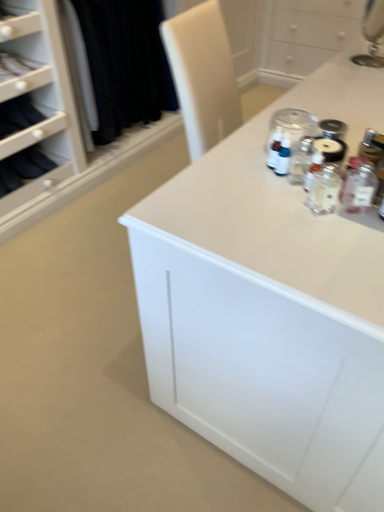
Describe the element at coordinates (292, 125) in the screenshot. Image resolution: width=384 pixels, height=512 pixels. I see `clear glass jar at upper center` at that location.

This screenshot has height=512, width=384. I want to click on clear glass bottle at right, the 1th bottle in the right-to-left sequence, so click(362, 189).

The width and height of the screenshot is (384, 512). Identify the location of clear glass jar at upper center. click(292, 125).

At what (x,y) coordinates should I click in order to perform the action: click on glass jar that appears below the white glossy countertop at upper right (from the image's perspective). Please return your answer as a coordinate pair (x, y). The width and height of the screenshot is (384, 512). Looking at the image, I should click on (292, 125).

Does white glossy countertop at upper right appear on the left side of clear glass jar at upper center?

Incorrect, white glossy countertop at upper right is not on the left side of clear glass jar at upper center.

Is white glossy countertop at upper right shorter than clear glass jar at upper center?

Indeed, white glossy countertop at upper right has a lesser height compared to clear glass jar at upper center.

Could you tell me if white glossy countertop at upper right is turned towards clear glass jar at upper center?

No, white glossy countertop at upper right does not turn towards clear glass jar at upper center.

From the picture: From a real-world perspective, is clear glass jar at upper center positioned over white glossy countertop at upper right based on gravity?

Correct, in the physical world, clear glass jar at upper center is higher than white glossy countertop at upper right.

Does clear glass jar at upper center have a lesser height compared to white glossy countertop at upper right?

No.

Can you see clear glass jar at upper center touching white glossy countertop at upper right?

There is a gap between clear glass jar at upper center and white glossy countertop at upper right.

This screenshot has width=384, height=512. Identify the location of countertop above the clear glass jar at upper center (from the image's perspective). (271, 307).

Who is taller, matte black fabric at upper left or white glossy countertop at upper right?

matte black fabric at upper left.

Can you confirm if matte black fabric at upper left is positioned to the left of white glossy countertop at upper right?

Correct, you'll find matte black fabric at upper left to the left of white glossy countertop at upper right.

Can you tell me how much matte black fabric at upper left and white glossy countertop at upper right differ in facing direction?

They differ by 90.2 degrees in their facing directions.

From a real-world perspective, is matte black fabric at upper left below white glossy countertop at upper right?

Actually, matte black fabric at upper left is physically above white glossy countertop at upper right in the real world.

Which is behind, point (331, 196) or point (246, 394)?

The point (246, 394) is behind.

Looking at this image, is clear glass bottle at center, which is the first bottle in left-to-right order, in front of white glossy countertop at upper right?

No, clear glass bottle at center, which is the first bottle in left-to-right order, is further to the viewer.

Is clear glass bottle at center, acting as the second bottle starting from the right, not within white glossy countertop at upper right?

clear glass bottle at center, acting as the second bottle starting from the right, is positioned outside white glossy countertop at upper right.

Are clear glass bottle at center, acting as the second bottle starting from the right, and white glossy countertop at upper right far apart?

No, there isn't a large distance between clear glass bottle at center, acting as the second bottle starting from the right, and white glossy countertop at upper right.

Is clear glass bottle at center, acting as the second bottle starting from the right, not inside clear glass jar at upper center?

Yes, clear glass bottle at center, acting as the second bottle starting from the right, is not within clear glass jar at upper center.

Considering the positions of objects clear glass bottle at center, acting as the second bottle starting from the right, and clear glass jar at upper center in the image provided, who is more to the right, clear glass bottle at center, acting as the second bottle starting from the right, or clear glass jar at upper center?

clear glass bottle at center, acting as the second bottle starting from the right.

From a real-world perspective, which is physically below, clear glass bottle at center, which is the first bottle in left-to-right order, or clear glass jar at upper center?

From a 3D spatial view, clear glass bottle at center, which is the first bottle in left-to-right order, is below.

Considering the positions of objects clear glass jar at upper center and clear glass bottle at center, which is the first bottle in left-to-right order, in the image provided, who is more to the right, clear glass jar at upper center or clear glass bottle at center, which is the first bottle in left-to-right order,?

From the viewer's perspective, clear glass bottle at center, which is the first bottle in left-to-right order, appears more on the right side.

Is clear glass jar at upper center touching clear glass bottle at center, acting as the second bottle starting from the right?

There is a gap between clear glass jar at upper center and clear glass bottle at center, acting as the second bottle starting from the right.

From the image's perspective, would you say clear glass jar at upper center is shown under clear glass bottle at center, acting as the second bottle starting from the right?

Incorrect, from the image's perspective, clear glass jar at upper center is higher than clear glass bottle at center, acting as the second bottle starting from the right.

Is point (322, 407) closer or farther from the camera than point (328, 189)?

Point (322, 407) is positioned farther from the camera compared to point (328, 189).

Is white glossy countertop at upper right bigger or smaller than clear glass bottle at center, acting as the second bottle starting from the right?

white glossy countertop at upper right is bigger than clear glass bottle at center, acting as the second bottle starting from the right.

Between white glossy countertop at upper right and clear glass bottle at center, which is the first bottle in left-to-right order, which one is positioned behind?

clear glass bottle at center, which is the first bottle in left-to-right order, is more distant.

You are a GUI agent. You are given a task and a screenshot of the screen. Output one action in this format:
    pyautogui.click(x=<x>, y=<y>)
    Task: Click on the glass jar on the left of white glossy countertop at upper right
    
    Given the screenshot: What is the action you would take?
    pyautogui.click(x=292, y=125)

Locate an element on the screen. countertop in front of the clear glass jar at upper center is located at coordinates (271, 307).

Considering their positions, is clear glass jar at upper center positioned further to clear glass bottle at right, the 1th bottle in the right-to-left sequence, than white glossy countertop at upper right?

Among the two, white glossy countertop at upper right is located further to clear glass bottle at right, the 1th bottle in the right-to-left sequence.

Considering their positions, is matte black fabric at upper left positioned further to clear glass bottle at right, the 1th bottle in the right-to-left sequence, than clear glass jar at upper center?

matte black fabric at upper left.

Considering their positions, is white glossy countertop at upper right positioned closer to clear glass jar at upper center than clear glass bottle at right, positioned as the second bottle in left-to-right order?

The object closer to clear glass jar at upper center is clear glass bottle at right, positioned as the second bottle in left-to-right order.

When comparing their distances from clear glass jar at upper center, does clear glass bottle at right, positioned as the second bottle in left-to-right order, or clear glass bottle at center, acting as the second bottle starting from the right, seem closer?

Among the two, clear glass bottle at center, acting as the second bottle starting from the right, is located nearer to clear glass jar at upper center.

Which object lies further to the anchor point white glossy countertop at upper right, clear glass bottle at right, positioned as the second bottle in left-to-right order, or matte black fabric at upper left?

The object further to white glossy countertop at upper right is matte black fabric at upper left.

When comparing their distances from clear glass jar at upper center, does clear glass bottle at center, acting as the second bottle starting from the right, or white glossy countertop at upper right seem further?

white glossy countertop at upper right is positioned further to the anchor clear glass jar at upper center.

In the scene shown: Estimate the real-world distances between objects in this image. Which object is closer to white glossy countertop at upper right, clear glass bottle at right, positioned as the second bottle in left-to-right order, or clear glass bottle at center, which is the first bottle in left-to-right order?

clear glass bottle at center, which is the first bottle in left-to-right order, is positioned closer to the anchor white glossy countertop at upper right.

From the image, which object appears to be nearer to clear glass jar at upper center, white glossy countertop at upper right or clear glass bottle at center, which is the first bottle in left-to-right order?

clear glass bottle at center, which is the first bottle in left-to-right order, is positioned closer to the anchor clear glass jar at upper center.

Locate an element on the screen. bottle between white glossy countertop at upper right and clear glass bottle at center, which is the first bottle in left-to-right order, in the vertical direction is located at coordinates (362, 189).

Locate an element on the screen. This screenshot has height=512, width=384. glass jar between clear glass bottle at right, the 1th bottle in the right-to-left sequence, and matte black fabric at upper left, along the z-axis is located at coordinates (292, 125).

At what (x,y) coordinates should I click in order to perform the action: click on glass jar between white glossy countertop at upper right and matte black fabric at upper left in the front-back direction. Please return your answer as a coordinate pair (x, y). The image size is (384, 512). Looking at the image, I should click on (292, 125).

Where is `bottle between clear glass bottle at right, positioned as the second bottle in left-to-right order, and matte black fabric at upper left in the front-back direction`? The height and width of the screenshot is (512, 384). bottle between clear glass bottle at right, positioned as the second bottle in left-to-right order, and matte black fabric at upper left in the front-back direction is located at coordinates (324, 191).